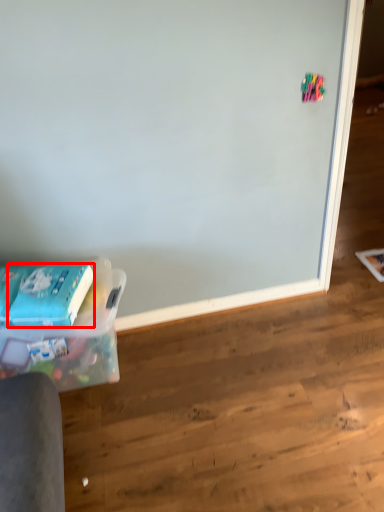
Question: In this image, where is paperback book (annotated by the red box) located relative to box?

Choices:
 (A) left
 (B) right

Answer: (A)